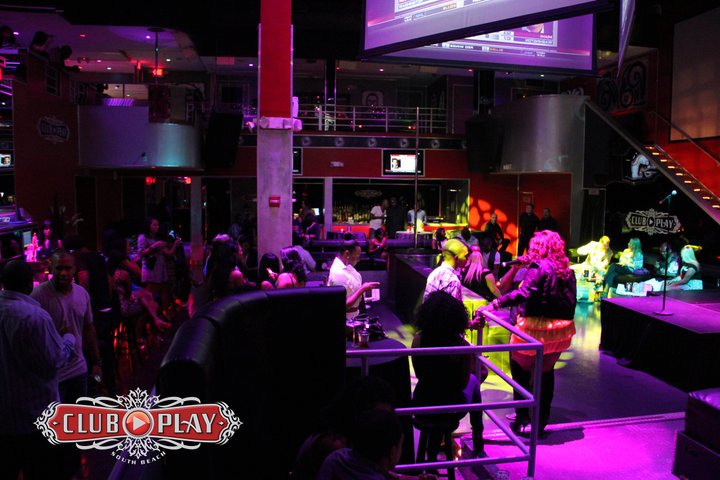
Locate an element on the screen. This screenshot has width=720, height=480. television is located at coordinates (404, 161), (422, 11), (520, 43), (626, 14).